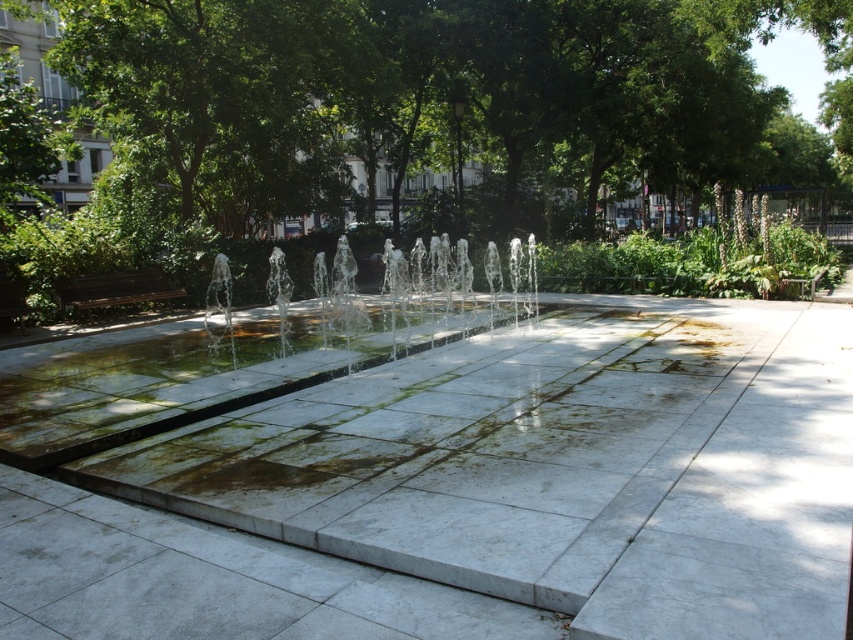
Is point (538, 204) farther from camera compared to point (730, 547)?

Yes, it is behind point (730, 547).

Is green leafy tree at center positioned before white marble pavement at center?

No.

Who is more forward, (132, 61) or (573, 474)?

Point (573, 474) is in front.

Where is `green leafy tree at center`? The height and width of the screenshot is (640, 853). green leafy tree at center is located at coordinates (407, 118).

Can you confirm if green leafy tree at center is positioned to the left of clear glass water jets at center?

Incorrect, green leafy tree at center is not on the left side of clear glass water jets at center.

Who is more forward, (x=540, y=179) or (x=235, y=332)?

Point (x=235, y=332) is in front.

At what (x,y) coordinates should I click in order to perform the action: click on green leafy tree at center. Please return your answer as a coordinate pair (x, y). This screenshot has width=853, height=640. Looking at the image, I should click on (407, 118).

Looking at this image, can you confirm if white marble pavement at center is smaller than clear glass water jets at center?

Yes, white marble pavement at center is smaller than clear glass water jets at center.

Can you confirm if white marble pavement at center is positioned to the left of clear glass water jets at center?

No, white marble pavement at center is not to the left of clear glass water jets at center.

Image resolution: width=853 pixels, height=640 pixels. Describe the element at coordinates (560, 467) in the screenshot. I see `white marble pavement at center` at that location.

Locate an element on the screen. white marble pavement at center is located at coordinates (560, 467).